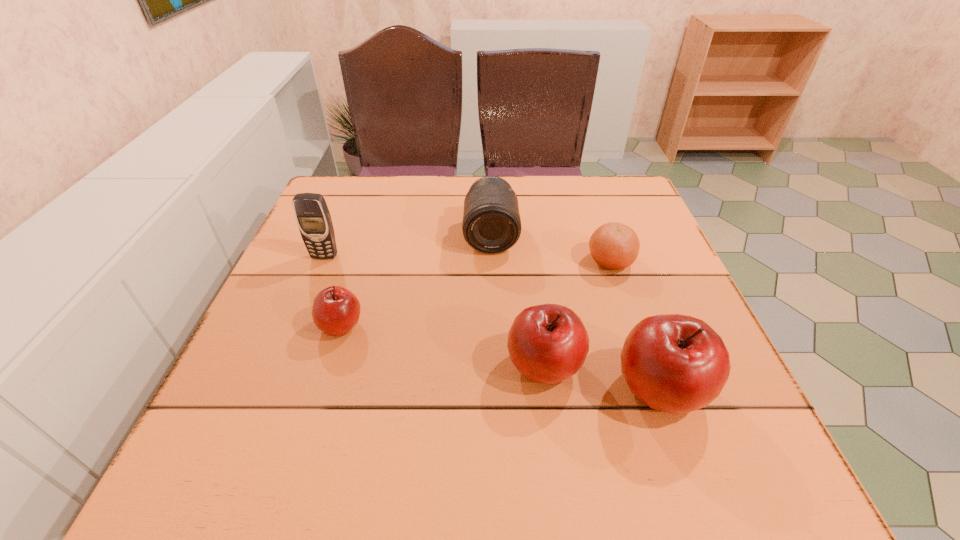
Image resolution: width=960 pixels, height=540 pixels. I want to click on the leftmost apple, so click(336, 310).

I want to click on the fifth object from right to left, so click(336, 310).

Identify the location of the second apple from left to right. This screenshot has height=540, width=960. (548, 343).

Find the location of a particular element. Image resolution: width=960 pixels, height=540 pixels. the rightmost apple is located at coordinates (675, 363).

In order to click on telephoto lens in this screenshot , I will do `click(491, 224)`.

I want to click on cellular telephone, so click(x=313, y=218).

Locate an element on the screen. The height and width of the screenshot is (540, 960). clementine is located at coordinates (615, 246).

Identify the location of free spot located 0.390m on the right of the leftmost apple. (561, 326).

Find the location of a particular element. The height and width of the screenshot is (540, 960). vacant space located 0.380m on the back of the second apple from left to right is located at coordinates (525, 224).

This screenshot has width=960, height=540. What are the coordinates of `vacant region located 0.360m on the back of the rightmost apple` in the screenshot? It's located at (607, 237).